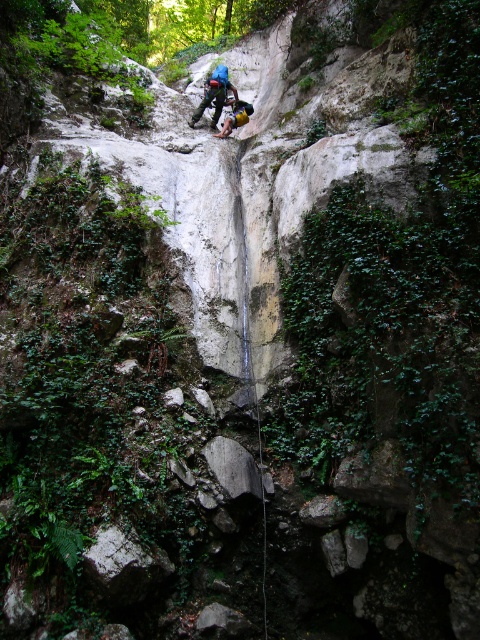
You are a hiker planning to set up a campsite near the rocky cliff face with the small waterfall. You need to place your gear so that it stays dry. Considering the blue fabric backpack at center, where should you position it relative to the waterfall to avoid getting wet?

The blue fabric backpack at center is located at point [214,93], which is below the waterfall. To keep it dry, you should move it to a higher elevation or to the side away from the waterfall spray.